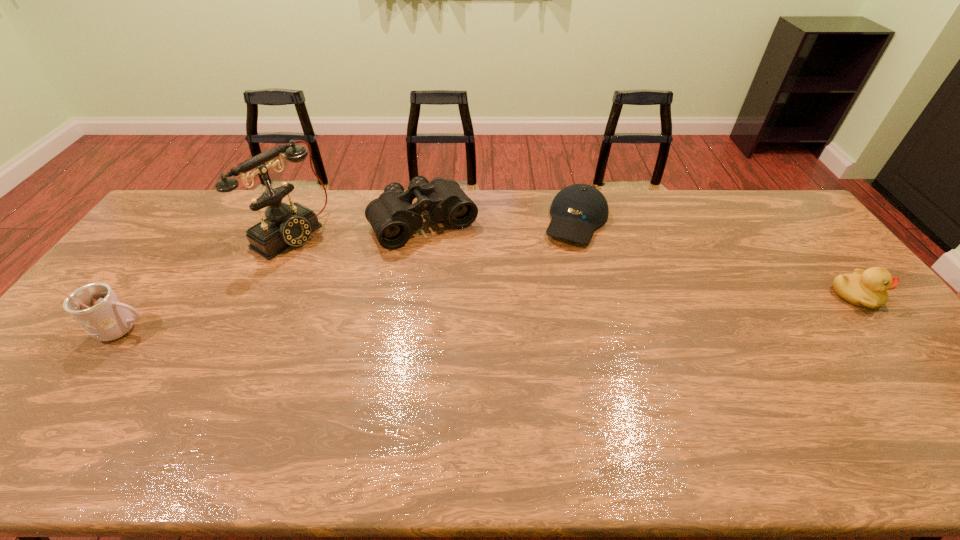
Where is `free spot on the desktop that is between the cup and the rightmost object and is positioned at the eyepieces of the binoculars`? The width and height of the screenshot is (960, 540). free spot on the desktop that is between the cup and the rightmost object and is positioned at the eyepieces of the binoculars is located at coordinates tap(483, 313).

This screenshot has height=540, width=960. I want to click on vacant spot on the desktop that is between the cup and the duckling and is positioned on the dial of the telephone, so click(432, 315).

I want to click on free space on the desktop that is between the cup and the duckling and is positioned on the front-facing side of the baseball cap, so click(x=539, y=310).